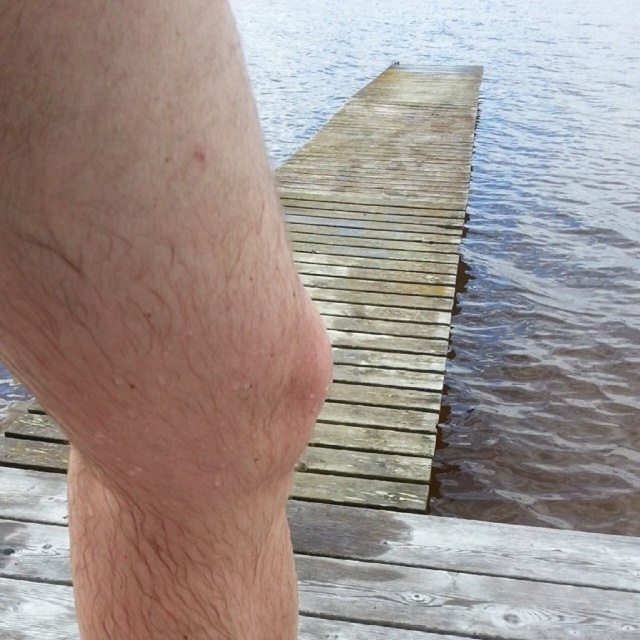
You are a lifeguard on duty and notice a swimmer struggling near the brown wooden dock at center. You are standing on the hairless skin at center. Can you reach the swimmer by extending your arm without moving your position?

The hairless skin at center is shorter than the brown wooden dock at center, so you cannot reach the swimmer since your arm length is shorter than the distance to the dock.

You are a photographer trying to capture the reflection of the dock in the water. You notice two points marked on your camera screen at coordinates point [92,45] and point [429,35]. Which point should you focus on to ensure the reflection is sharp and clear?

You should focus on point [92,45] because it is closer to the viewer, making it easier to capture a sharp reflection compared to point [429,35] which is further away.